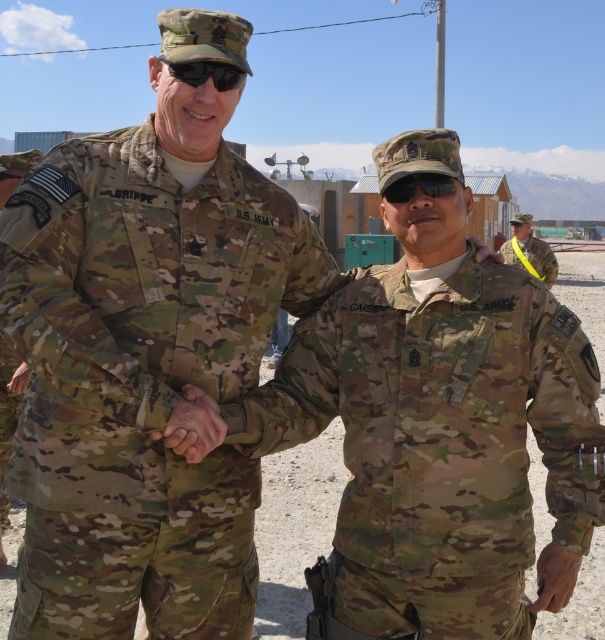
Question: Does multicam uniform at center appear under camouflage fabric uniform at center?

Choices:
 (A) no
 (B) yes

Answer: (B)

Question: Which point is closer to the camera?

Choices:
 (A) multicam uniform at center
 (B) camouflage fabric uniform at center
 (C) black matte sunglasses at upper center
 (D) camouflage uniform at right

Answer: (A)

Question: Which object is farther from the camera taking this photo?

Choices:
 (A) black matte sunglasses at center
 (B) black matte sunglasses at upper center
 (C) multicam uniform at center

Answer: (A)

Question: Is camouflage fabric uniform at center smaller than camouflage uniform at right?

Choices:
 (A) yes
 (B) no

Answer: (B)

Question: Among these objects, which one is farthest from the camera?

Choices:
 (A) camouflage fabric uniform at center
 (B) camouflage uniform at right
 (C) black matte sunglasses at center
 (D) black matte sunglasses at upper center

Answer: (A)

Question: Observing the image, what is the correct spatial positioning of multicam uniform at center in reference to black matte sunglasses at upper center?

Choices:
 (A) below
 (B) above

Answer: (A)